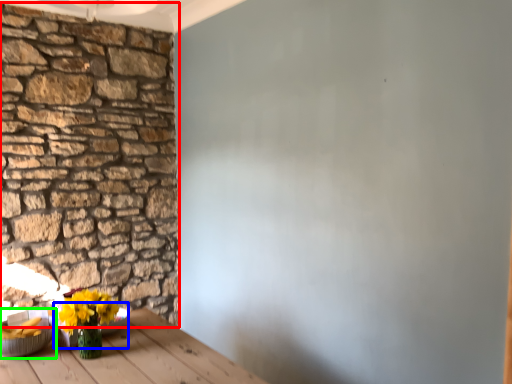
Question: Which object is positioned closest to brick (highlighted by a red box)? Select from bowl (highlighted by a blue box) and bowl (highlighted by a green box).

Choices:
 (A) bowl
 (B) bowl

Answer: (B)